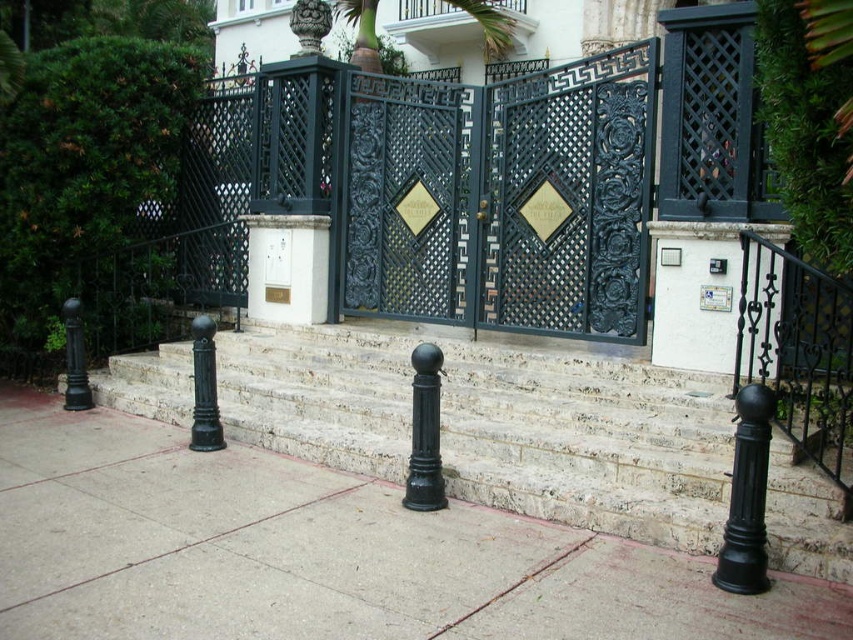
Which is behind, point (363, 269) or point (775, 278)?

Positioned behind is point (363, 269).

Measure the distance between point (408, 83) and camera.

They are 8.18 meters apart.

Where is `dark blue wrought iron gate at center`? dark blue wrought iron gate at center is located at coordinates (405, 198).

Is point (834, 540) positioned behind point (840, 404)?

No, it is not.

Is the position of white marble stairs at center less distant than that of black wrought iron railing at right?

No, white marble stairs at center is behind black wrought iron railing at right.

Who is more forward, (764, 508) or (801, 417)?

Point (764, 508) is more forward.

Where is `white marble stairs at center`? white marble stairs at center is located at coordinates (497, 420).

Is black wrought iron gate at center taller than dark blue wrought iron gate at center?

In fact, black wrought iron gate at center may be shorter than dark blue wrought iron gate at center.

Can you confirm if black wrought iron gate at center is positioned to the left of dark blue wrought iron gate at center?

Incorrect, black wrought iron gate at center is not on the left side of dark blue wrought iron gate at center.

Does point (651, 49) come farther from viewer compared to point (459, 188)?

That is False.

Identify the location of black wrought iron gate at center. The height and width of the screenshot is (640, 853). (570, 195).